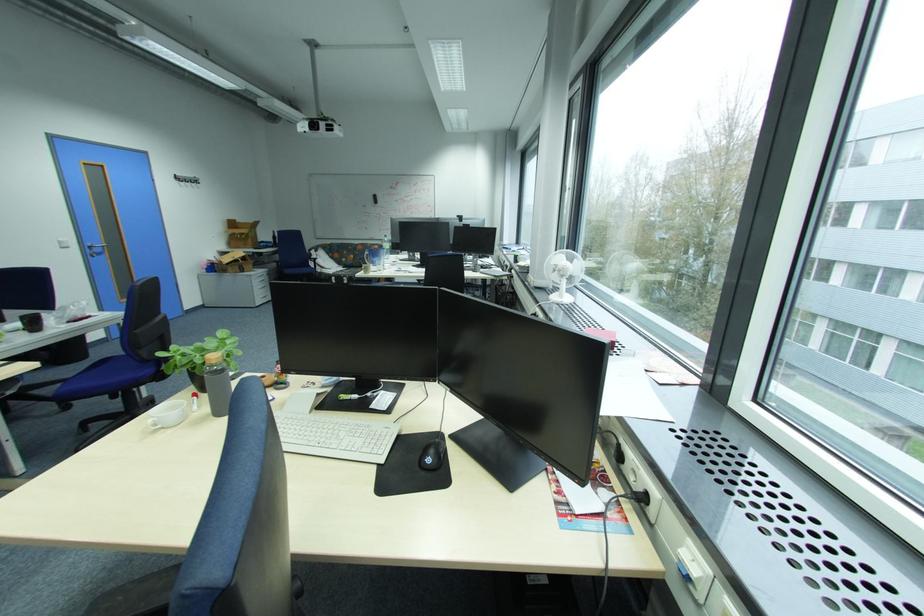
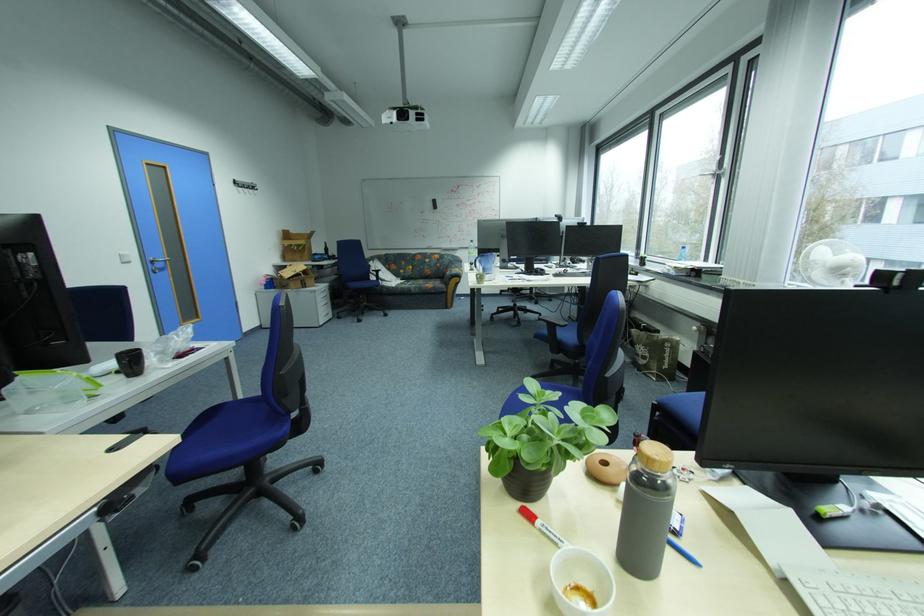
Find the pixel in the second image that matches the point at 69,240 in the first image.

(130, 254)